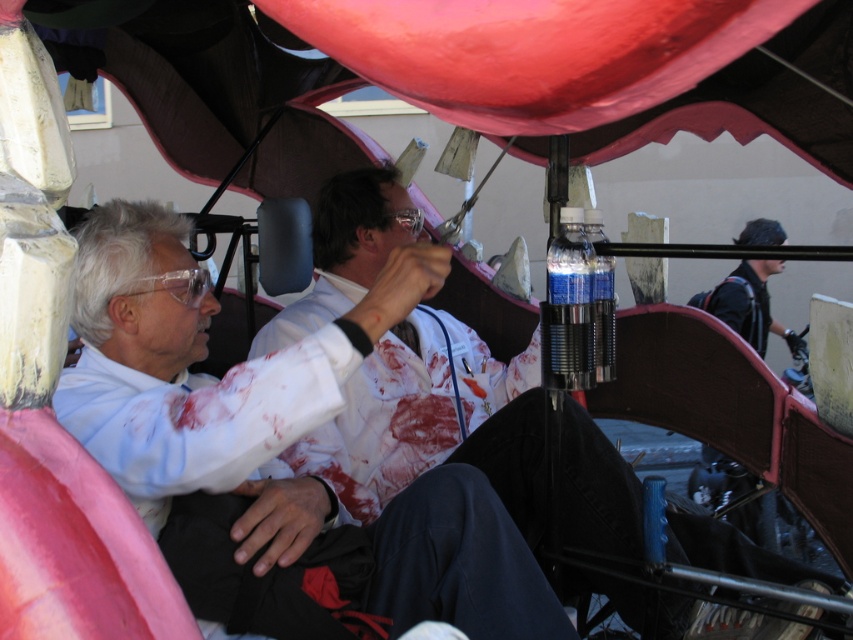
Based on the photo, you are a safety inspector checking the hot air balloon basket. You need to ensure that the white matte lab coat at center is within a safe distance of 2 meters from the camera for proper visibility. Is the current distance acceptable?

The white matte lab coat at center is 1.85 meters away from the camera, which is within the 2 meters safety requirement, so it is acceptable.